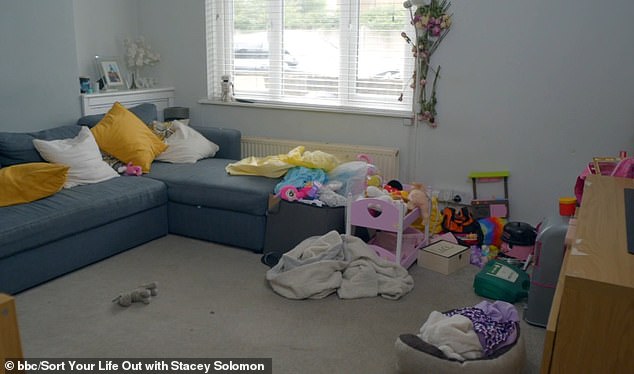
What are the coordinates of `chairs` in the screenshot? It's located at (376, 217), (477, 171).